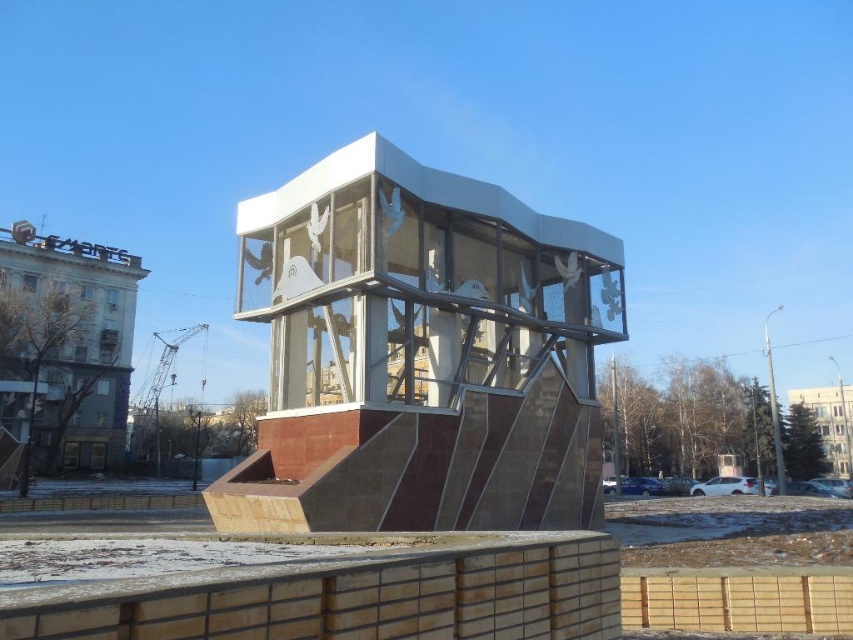
Question: Can you confirm if white glossy sculpture at center is positioned below white glossy dove at center?

Choices:
 (A) no
 (B) yes

Answer: (B)

Question: Among these objects, which one is nearest to the camera?

Choices:
 (A) white glossy sculpture at center
 (B) white glossy dove at center

Answer: (A)

Question: Which object is farther from the camera taking this photo?

Choices:
 (A) white glossy dove at center
 (B) white glossy sculpture at center

Answer: (A)

Question: Does white glossy sculpture at center have a smaller size compared to white glossy dove at center?

Choices:
 (A) yes
 (B) no

Answer: (B)

Question: Does white glossy sculpture at center appear over white glossy dove at center?

Choices:
 (A) no
 (B) yes

Answer: (A)